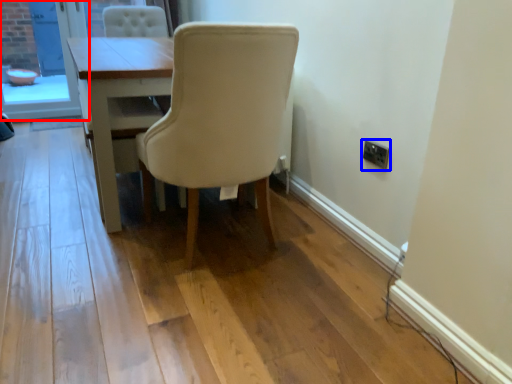
Question: Which of the following is the closest to the observer, screen door (highlighted by a red box) or electric outlet (highlighted by a blue box)?

Choices:
 (A) screen door
 (B) electric outlet

Answer: (B)